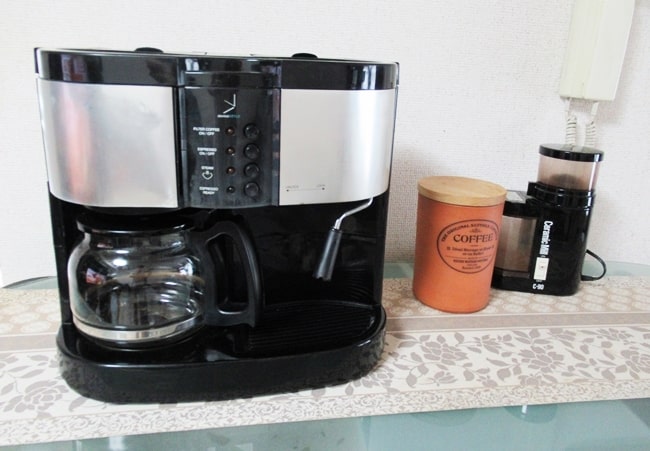
I want to click on counter top, so click(495, 358).